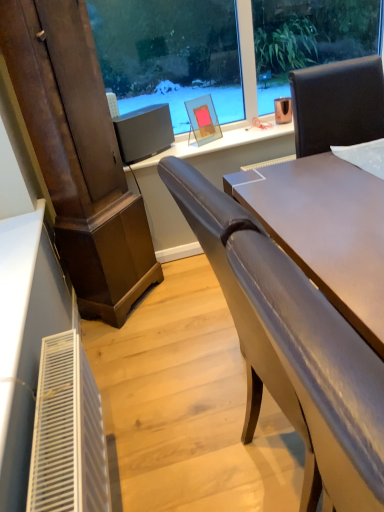
Question: Is point [129, 124] closer or farther from the camera than point [367, 421]?

Choices:
 (A) closer
 (B) farther

Answer: (B)

Question: In the image, is matte black monitor at center on the left side or the right side of matte gray chair at center?

Choices:
 (A) left
 (B) right

Answer: (A)

Question: Considering the real-world distances, which object is farthest from the matte gray chair at center?

Choices:
 (A) matte black monitor at center
 (B) matte glass picture frame at center

Answer: (B)

Question: Based on their relative distances, which object is nearer to the matte glass picture frame at center?

Choices:
 (A) matte black monitor at center
 (B) matte gray chair at center

Answer: (A)